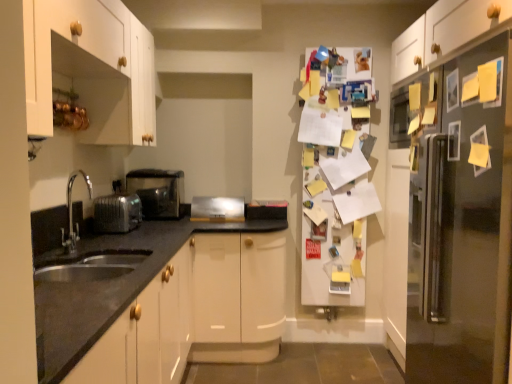
Question: Which direction should I rotate to look at satin silver toaster at center, which is counted as the second appliance, starting from the front, — up or down?

Choices:
 (A) up
 (B) down

Answer: (B)

Question: Is satin silver refrigerator at right, placed as the 1th fridge when sorted from front to back, directly adjacent to satin nickel faucet at lower left?

Choices:
 (A) yes
 (B) no

Answer: (B)

Question: Could you tell me if satin silver refrigerator at right, which is the 2th fridge from back to front, is facing satin nickel faucet at lower left?

Choices:
 (A) no
 (B) yes

Answer: (B)

Question: Is satin nickel faucet at lower left completely or partially inside satin silver refrigerator at right, placed as the 1th fridge when sorted from front to back?

Choices:
 (A) no
 (B) yes

Answer: (A)

Question: Is satin silver refrigerator at right, placed as the 1th fridge when sorted from front to back, bigger than satin nickel faucet at lower left?

Choices:
 (A) yes
 (B) no

Answer: (A)

Question: Does satin silver refrigerator at right, which is counted as the second fridge, starting from the left, have a greater width compared to satin nickel faucet at lower left?

Choices:
 (A) yes
 (B) no

Answer: (A)

Question: Is satin nickel faucet at lower left at the back of satin silver refrigerator at right, which is counted as the second fridge, starting from the left?

Choices:
 (A) no
 (B) yes

Answer: (A)

Question: Does satin silver toaster at lower left, which is the first appliance in back-to-front order, touch satin silver toaster at center, the 1th appliance from the right?

Choices:
 (A) no
 (B) yes

Answer: (A)

Question: Can you confirm if satin silver toaster at lower left, which appears as the second appliance when viewed from the right, is positioned to the right of satin silver toaster at center, acting as the 3th appliance starting from the left?

Choices:
 (A) no
 (B) yes

Answer: (A)

Question: Is satin silver toaster at lower left, which appears as the second appliance when viewed from the left, outside satin silver toaster at center, which is counted as the second appliance, starting from the front?

Choices:
 (A) no
 (B) yes

Answer: (B)

Question: Considering the relative sizes of satin silver toaster at lower left, which appears as the second appliance when viewed from the right, and satin silver toaster at center, which is counted as the second appliance, starting from the front, in the image provided, is satin silver toaster at lower left, which appears as the second appliance when viewed from the right, bigger than satin silver toaster at center, which is counted as the second appliance, starting from the front,?

Choices:
 (A) no
 (B) yes

Answer: (B)

Question: Is satin silver toaster at lower left, which appears as the second appliance when viewed from the left, wider than satin silver toaster at center, which ranks as the 2th appliance in back-to-front order?

Choices:
 (A) yes
 (B) no

Answer: (A)

Question: From the image's perspective, is satin silver toaster at lower left, which is the first appliance in back-to-front order, below satin silver toaster at center, the 1th appliance from the right?

Choices:
 (A) yes
 (B) no

Answer: (B)

Question: Is satin silver toaster at lower left, marked as the first appliance in a left-to-right arrangement, bigger than satin silver refrigerator at right, placed as the 1th fridge when sorted from front to back?

Choices:
 (A) yes
 (B) no

Answer: (B)